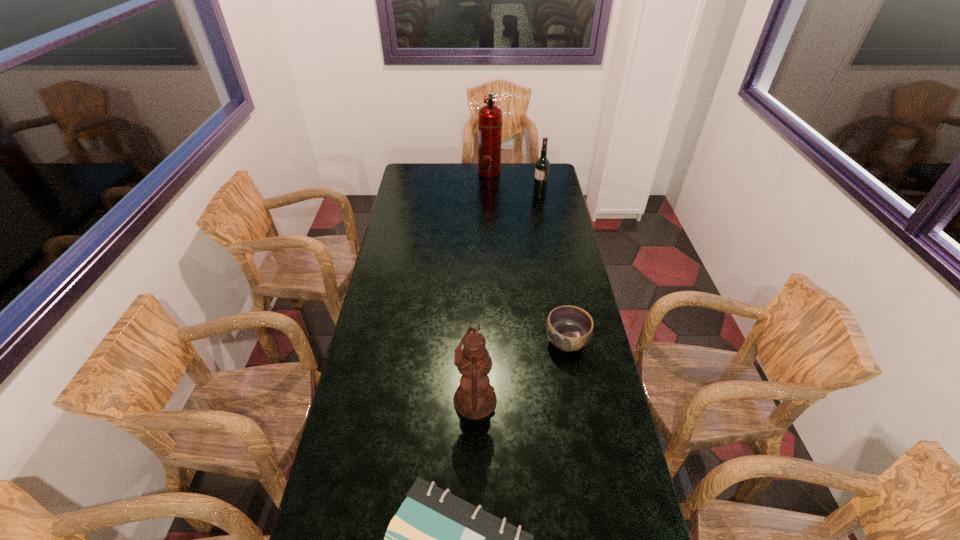
The height and width of the screenshot is (540, 960). What are the coordinates of `free space that satisfies the following two spatial constraints: 1. on the back side of the bowl; 2. on the front and back of the fourth nearest object` in the screenshot? It's located at (540, 196).

You are a GUI agent. You are given a task and a screenshot of the screen. Output one action in this format:
    pyautogui.click(x=<x>, y=<y>)
    Task: Click on the free location that satisfies the following two spatial constraints: 1. on the back side of the third farthest object; 2. on the nozzle side of the tallest object
    Image resolution: width=960 pixels, height=540 pixels.
    Given the screenshot: What is the action you would take?
    536,172

The height and width of the screenshot is (540, 960). I want to click on vacant position in the image that satisfies the following two spatial constraints: 1. on the nozzle side of the fire extinguisher; 2. on the front side of the oil lamp, so click(x=496, y=400).

The height and width of the screenshot is (540, 960). Find the location of `vacant area that satisfies the following two spatial constraints: 1. on the nozzle side of the farthest object; 2. on the front side of the oil lamp`. vacant area that satisfies the following two spatial constraints: 1. on the nozzle side of the farthest object; 2. on the front side of the oil lamp is located at coordinates (496, 400).

Locate an element on the screen. Image resolution: width=960 pixels, height=540 pixels. free space in the image that satisfies the following two spatial constraints: 1. on the nozzle side of the tallest object; 2. on the back side of the third nearest object is located at coordinates (494, 341).